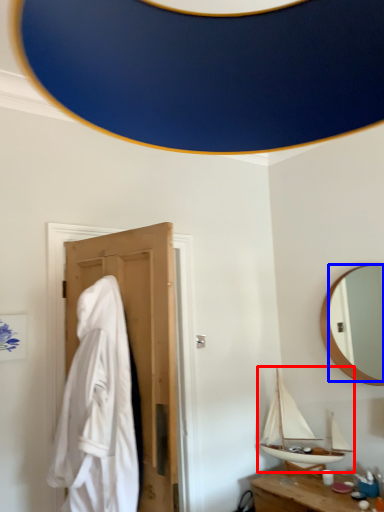
Question: Which object appears farthest to the camera in this image, boat (highlighted by a red box) or mirror (highlighted by a blue box)?

Choices:
 (A) boat
 (B) mirror

Answer: (A)